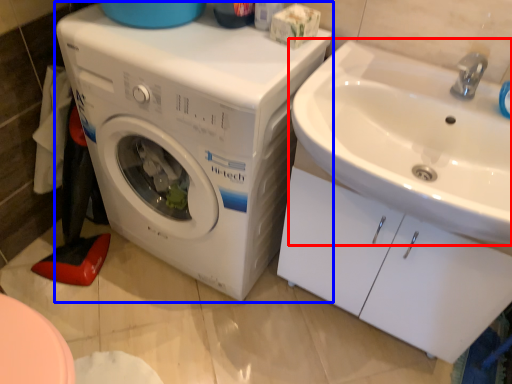
Question: Among these objects, which one is nearest to the camera, sink (highlighted by a red box) or washing machine (highlighted by a blue box)?

Choices:
 (A) sink
 (B) washing machine

Answer: (A)